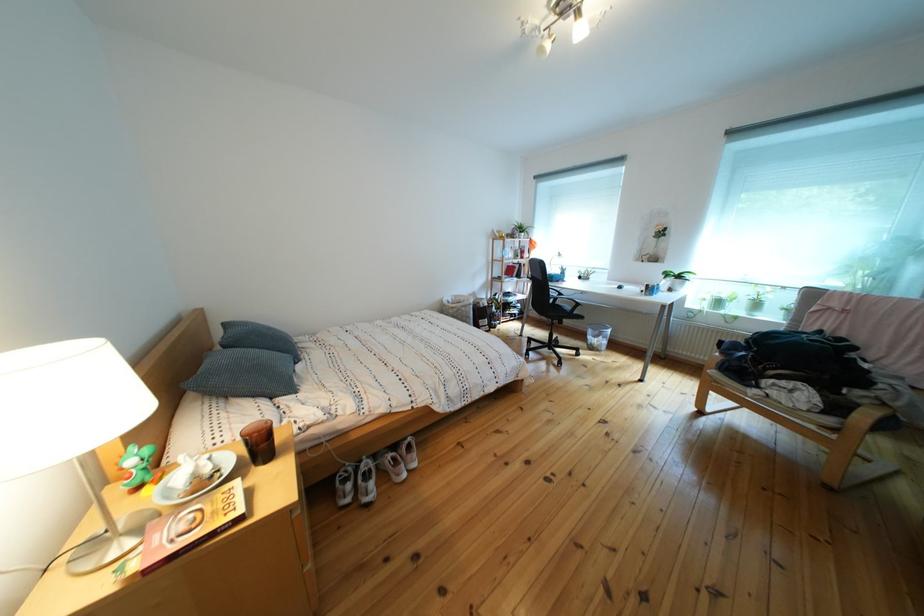
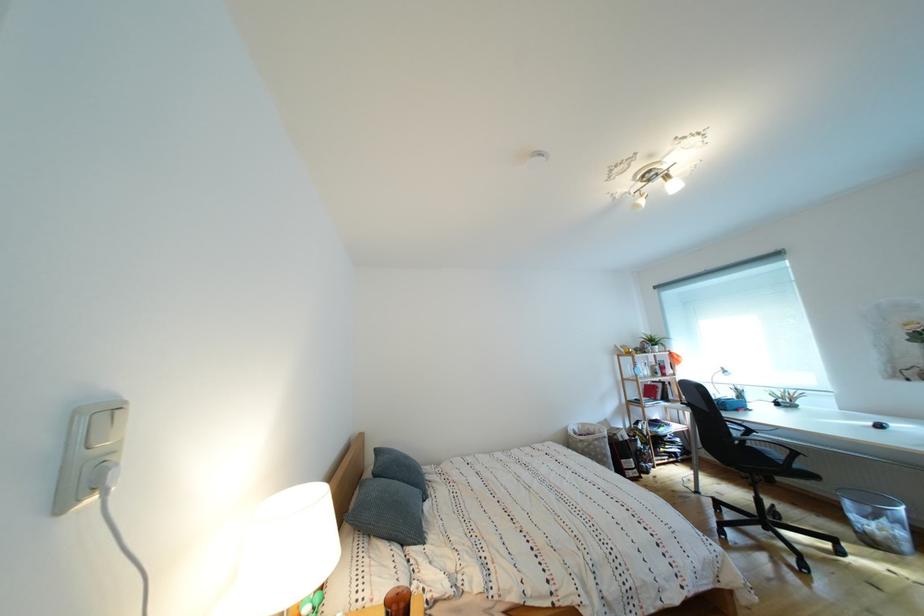
Where in the second image is the point corresponding to [613,342] from the first image?

(896, 527)